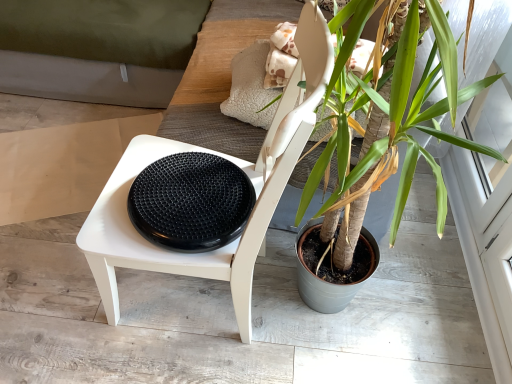
Question: From the image's perspective, does black rubber footrest at center appear lower than green leafy plant at center?

Choices:
 (A) no
 (B) yes

Answer: (B)

Question: Is black rubber footrest at center looking in the opposite direction of green leafy plant at center?

Choices:
 (A) yes
 (B) no

Answer: (B)

Question: From the image's perspective, is black rubber footrest at center on green leafy plant at center?

Choices:
 (A) no
 (B) yes

Answer: (A)

Question: From a real-world perspective, is black rubber footrest at center located beneath green leafy plant at center?

Choices:
 (A) no
 (B) yes

Answer: (A)

Question: Is the position of black rubber footrest at center less distant than that of green leafy plant at center?

Choices:
 (A) yes
 (B) no

Answer: (B)

Question: Is black rubber footrest at center in contact with green leafy plant at center?

Choices:
 (A) no
 (B) yes

Answer: (A)

Question: Is white matte chair at center next to green leafy plant at center and touching it?

Choices:
 (A) no
 (B) yes

Answer: (A)

Question: Are white matte chair at center and green leafy plant at center located far from each other?

Choices:
 (A) yes
 (B) no

Answer: (B)

Question: From a real-world perspective, is white matte chair at center beneath green leafy plant at center?

Choices:
 (A) no
 (B) yes

Answer: (B)

Question: Does white matte chair at center lie in front of green leafy plant at center?

Choices:
 (A) no
 (B) yes

Answer: (B)

Question: Does white matte chair at center have a smaller size compared to green leafy plant at center?

Choices:
 (A) yes
 (B) no

Answer: (A)

Question: Could you tell me if white matte chair at center is facing green leafy plant at center?

Choices:
 (A) yes
 (B) no

Answer: (B)

Question: Is green leafy plant at center positioned far away from black rubber footrest at center?

Choices:
 (A) no
 (B) yes

Answer: (A)